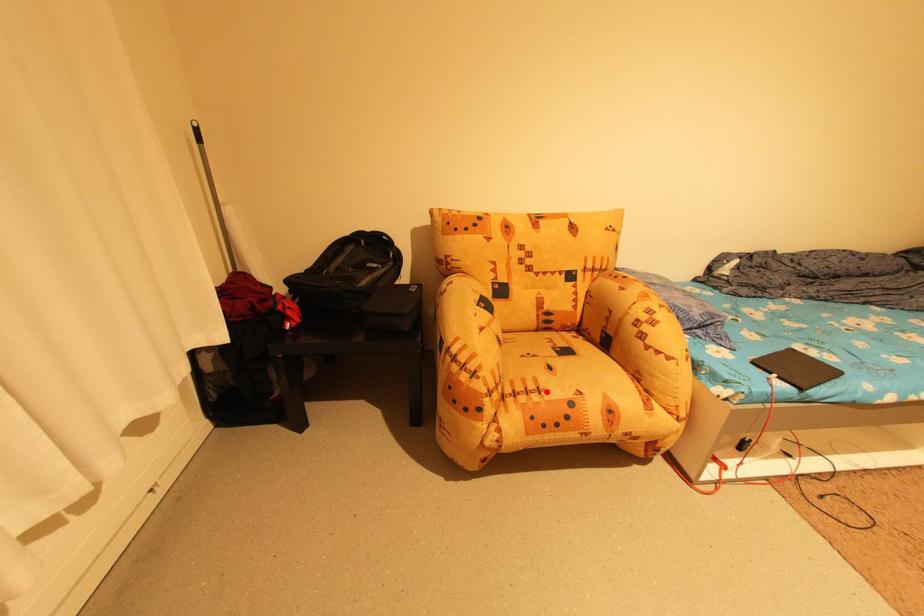
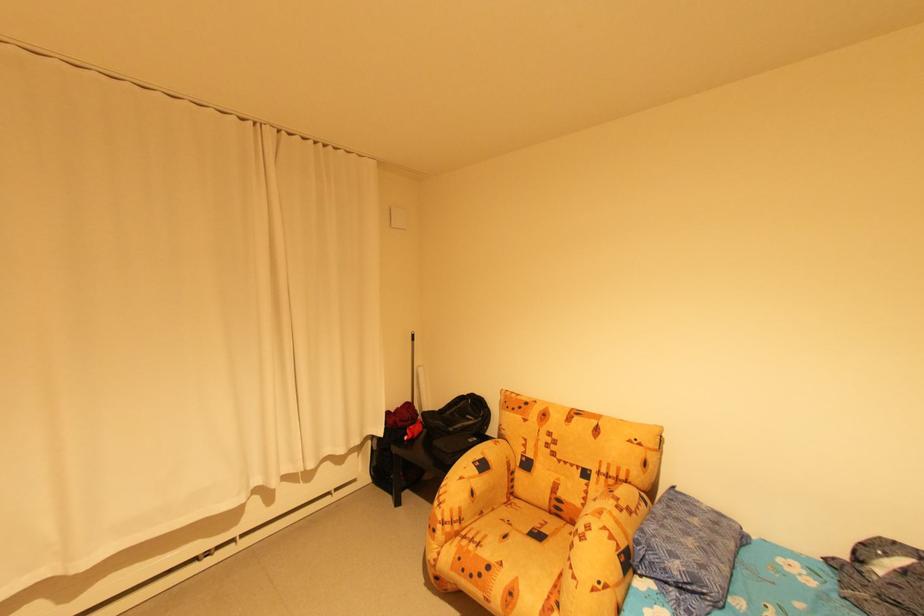
Find the pixel in the second image that matches the highlighted location in the first image.

(485, 545)